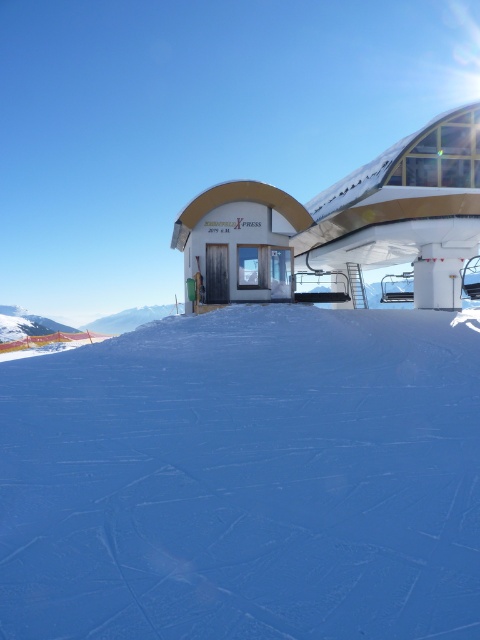
In the scene shown: Is white smooth snow at center to the right of white glossy building at center from the viewer's perspective?

No, white smooth snow at center is not to the right of white glossy building at center.

Can you confirm if white smooth snow at center is bigger than white glossy building at center?

Actually, white smooth snow at center might be smaller than white glossy building at center.

Identify the location of white smooth snow at center. (245, 480).